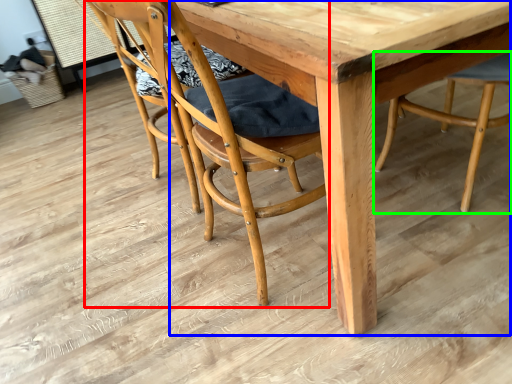
Question: Considering the real-world distances, which object is closest to chair (highlighted by a red box)? round table (highlighted by a blue box) or chair (highlighted by a green box).

Choices:
 (A) round table
 (B) chair

Answer: (A)